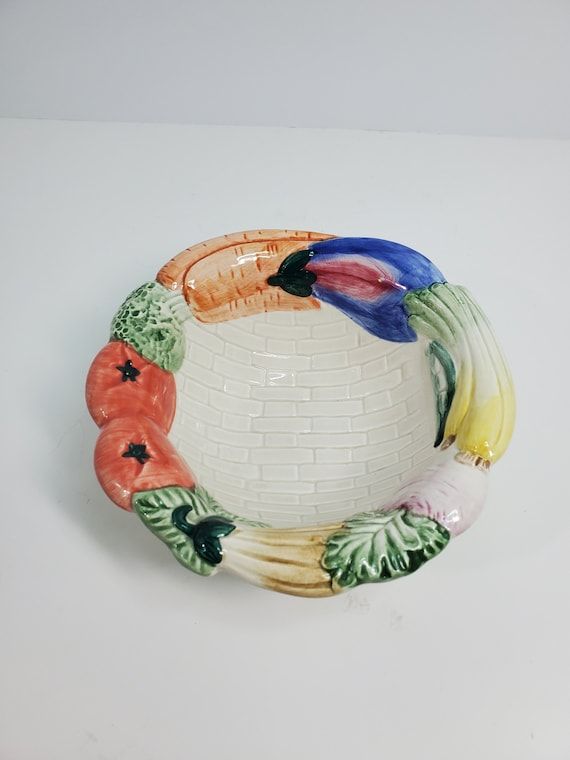
You are a GUI agent. You are given a task and a screenshot of the screen. Output one action in this format:
    pyautogui.click(x=<x>, y=<y>)
    Task: Click on the ceramic vegetables
    
    Given the screenshot: What is the action you would take?
    click(481, 394), click(447, 496), click(260, 558), click(137, 464), click(117, 385), click(199, 274), click(376, 261)